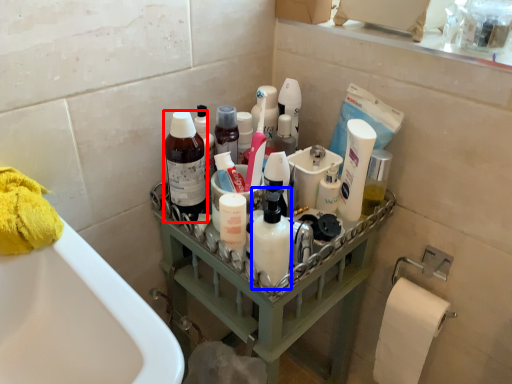
Question: Which object is closer to the camera taking this photo, cleaning product (highlighted by a red box) or cleaning product (highlighted by a blue box)?

Choices:
 (A) cleaning product
 (B) cleaning product

Answer: (B)